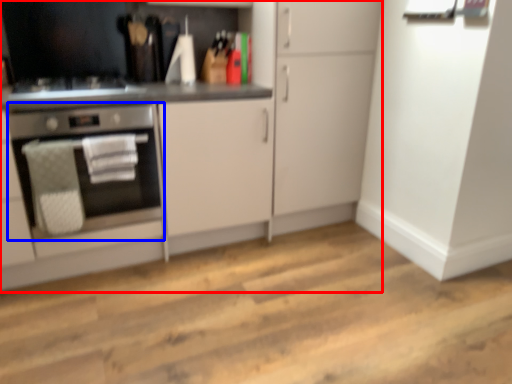
Question: Which object is further to the camera taking this photo, cabinetry (highlighted by a red box) or home appliance (highlighted by a blue box)?

Choices:
 (A) cabinetry
 (B) home appliance

Answer: (B)